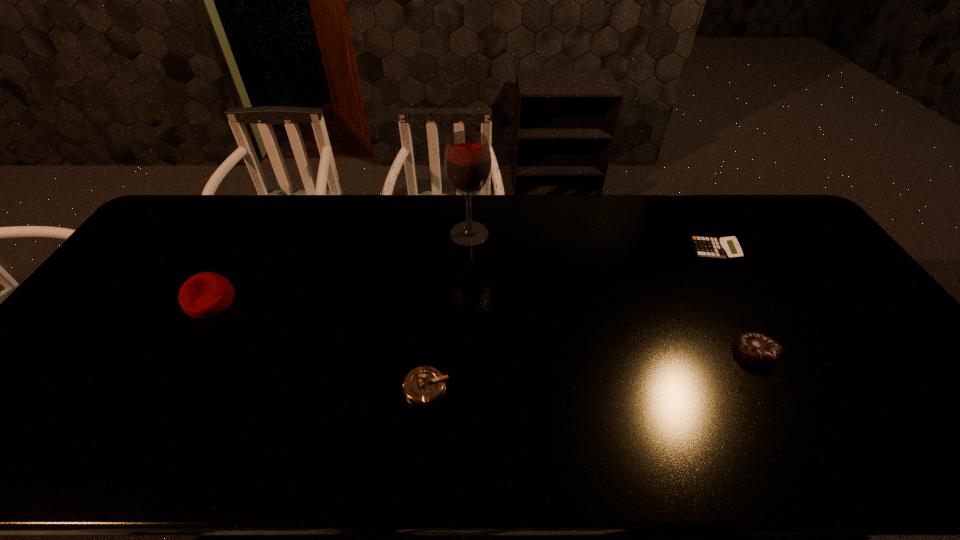
Where is `free point that satisfies the following two spatial constraints: 1. on the seat area of the left beanbag; 2. on the left side of the right beanbag`? The width and height of the screenshot is (960, 540). free point that satisfies the following two spatial constraints: 1. on the seat area of the left beanbag; 2. on the left side of the right beanbag is located at coordinates (180, 353).